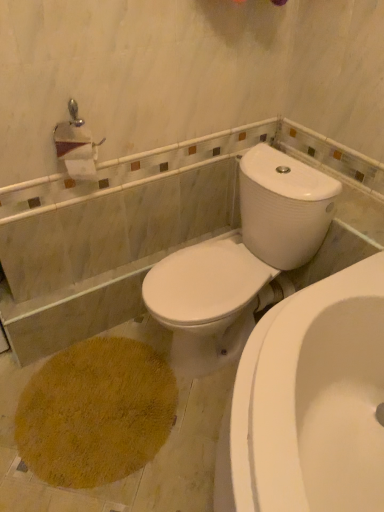
The height and width of the screenshot is (512, 384). What do you see at coordinates (242, 261) in the screenshot?
I see `white glossy toilet at center` at bounding box center [242, 261].

The image size is (384, 512). Identify the location of white glossy toilet at center. (242, 261).

Measure the distance between point (287, 181) and camera.

The depth of point (287, 181) is 4.66 feet.

Find the location of a particular element. Image resolution: width=384 pixels, height=512 pixels. white glossy water tank at upper right is located at coordinates (284, 207).

Describe the element at coordinates (284, 207) in the screenshot. I see `white glossy water tank at upper right` at that location.

Where is `white glossy toilet at center`? white glossy toilet at center is located at coordinates (242, 261).

Does white glossy water tank at upper right appear on the left side of white glossy toilet at center?

In fact, white glossy water tank at upper right is to the right of white glossy toilet at center.

Which is in front, white glossy water tank at upper right or white glossy toilet at center?

white glossy toilet at center is in front.

Considering the positions of point (281, 225) and point (304, 215), is point (281, 225) closer or farther from the camera than point (304, 215)?

Point (281, 225) is farther from the camera than point (304, 215).

From the image's perspective, which one is positioned lower, white glossy water tank at upper right or white glossy toilet at center?

white glossy toilet at center is shown below in the image.

From a real-world perspective, which object stands above the other?

white glossy water tank at upper right is physically above.

Is white glossy water tank at upper right wider or thinner than white glossy toilet at center?

In the image, white glossy water tank at upper right appears to be more narrow than white glossy toilet at center.

Is white glossy water tank at upper right taller than white glossy toilet at center?

No.

Who is bigger, white glossy water tank at upper right or white glossy toilet at center?

white glossy toilet at center is bigger.

Is white glossy water tank at upper right surrounding white glossy toilet at center?

No.

Is white glossy water tank at upper right with white glossy toilet at center?

Yes.

Is white glossy water tank at upper right facing away from white glossy toilet at center?

No.

How far apart are white glossy water tank at upper right and white glossy toilet at center?

white glossy water tank at upper right and white glossy toilet at center are 3.62 inches apart from each other.

Locate an element on the screen. The height and width of the screenshot is (512, 384). toilet below the white glossy water tank at upper right (from the image's perspective) is located at coordinates (242, 261).

Is white glossy toilet at center to the right of white glossy water tank at upper right from the viewer's perspective?

Incorrect, white glossy toilet at center is not on the right side of white glossy water tank at upper right.

Who is more distant, white glossy toilet at center or white glossy water tank at upper right?

white glossy water tank at upper right is further from the camera.

Does point (226, 298) come farther from viewer compared to point (253, 223)?

That is False.

From the image's perspective, which is above, white glossy toilet at center or white glossy water tank at upper right?

white glossy water tank at upper right.

From a real-world perspective, between white glossy toilet at center and white glossy water tank at upper right, who is vertically higher?

white glossy water tank at upper right.

Considering the sizes of objects white glossy toilet at center and white glossy water tank at upper right in the image provided, who is wider, white glossy toilet at center or white glossy water tank at upper right?

white glossy toilet at center.

Can you confirm if white glossy toilet at center is taller than white glossy water tank at upper right?

Yes.

Based on their sizes in the image, would you say white glossy toilet at center is bigger or smaller than white glossy water tank at upper right?

In the image, white glossy toilet at center appears to be larger than white glossy water tank at upper right.

Would you say white glossy water tank at upper right is part of white glossy toilet at center's contents?

No.

Is white glossy toilet at center touching white glossy water tank at upper right?

Yes, the surface of white glossy toilet at center is in contact with white glossy water tank at upper right.

Is white glossy toilet at center positioned with its back to white glossy water tank at upper right?

Absolutely, white glossy toilet at center is directed away from white glossy water tank at upper right.

Measure the distance from white glossy toilet at center to white glossy water tank at upper right.

white glossy toilet at center is 3.62 inches away from white glossy water tank at upper right.

Where is `toilet in front of the white glossy water tank at upper right`? This screenshot has width=384, height=512. toilet in front of the white glossy water tank at upper right is located at coordinates (242, 261).

Find the location of `water tank above the white glossy toilet at center (from a real-world perspective)`. water tank above the white glossy toilet at center (from a real-world perspective) is located at coordinates point(284,207).

Find the location of a particular element. This screenshot has width=384, height=512. water tank behind the white glossy toilet at center is located at coordinates (284, 207).